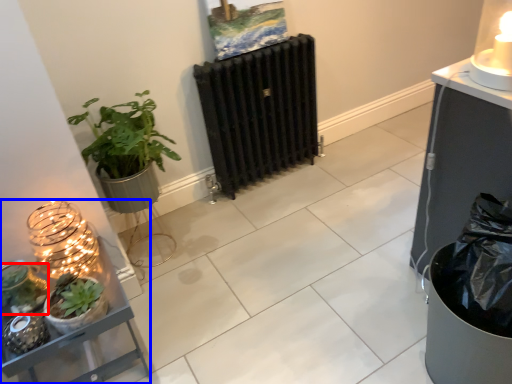
Question: Which object appears farthest to the camera in this image, vegetation (highlighted by a red box) or shelf (highlighted by a blue box)?

Choices:
 (A) vegetation
 (B) shelf

Answer: (A)